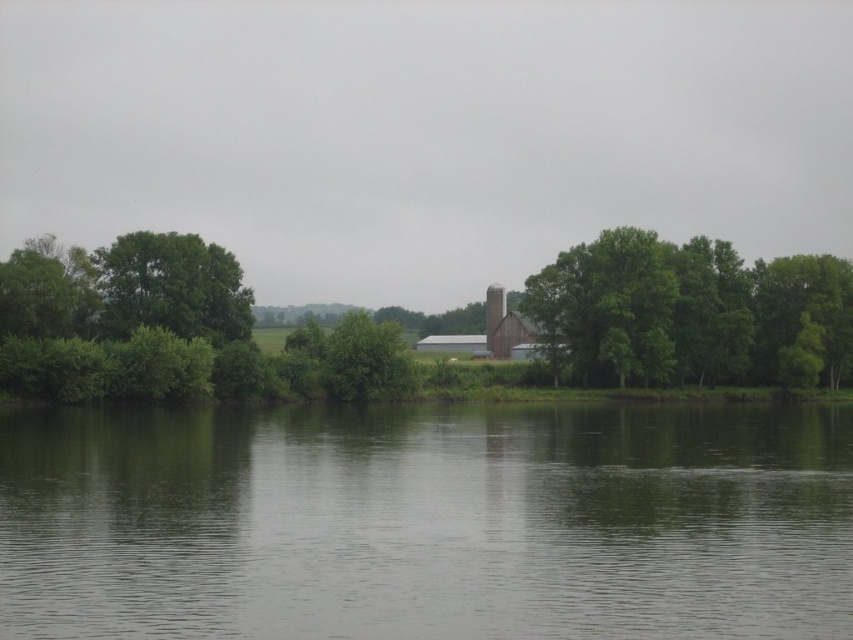
You are standing at the edge of the water in the serene rural landscape. You notice two points marked in the image. Which point, point (653, 440) or point (699, 275), is closer to you?

Point (653, 440) is closer to the viewer than point (699, 275).

You are a bird flying over the rural landscape. You want to land on the brown wooden chimney at center. From your current position above the green smooth water at lower center, which direction should you fly to reach the chimney?

The brown wooden chimney at center is taller than the green smooth water at lower center, so you should fly upwards to reach the chimney.

You are standing at the point with coordinates point (486, 307) and want to walk towards the point with coordinates point (613, 236). Based on the scene, will you have an unobstructed path to reach the destination?

Point (613, 236) is in front of point (486, 307), so yes, you will have an unobstructed path to reach the destination.